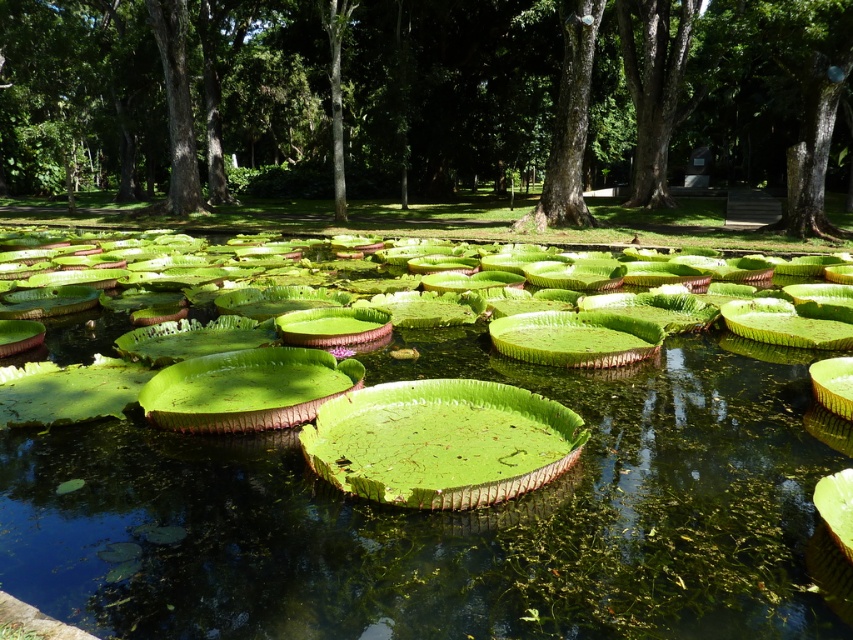
Question: Which point is closer to the camera?

Choices:
 (A) green leafy water at center
 (B) smooth bark tree at center
 (C) green leafy tree at center

Answer: (A)

Question: Estimate the real-world distances between objects in this image. Which object is farther from the smooth bark tree at center?

Choices:
 (A) green leafy tree at center
 (B) green leafy water at center

Answer: (A)

Question: Observing the image, what is the correct spatial positioning of green leafy water at center in reference to green leafy tree at center?

Choices:
 (A) above
 (B) below

Answer: (B)

Question: Is green leafy tree at center below smooth bark tree at center?

Choices:
 (A) no
 (B) yes

Answer: (A)

Question: Does green leafy water at center appear on the left side of green leafy tree at center?

Choices:
 (A) yes
 (B) no

Answer: (B)

Question: Considering the real-world distances, which object is closest to the smooth bark tree at center?

Choices:
 (A) green leafy water at center
 (B) green leafy tree at center

Answer: (A)